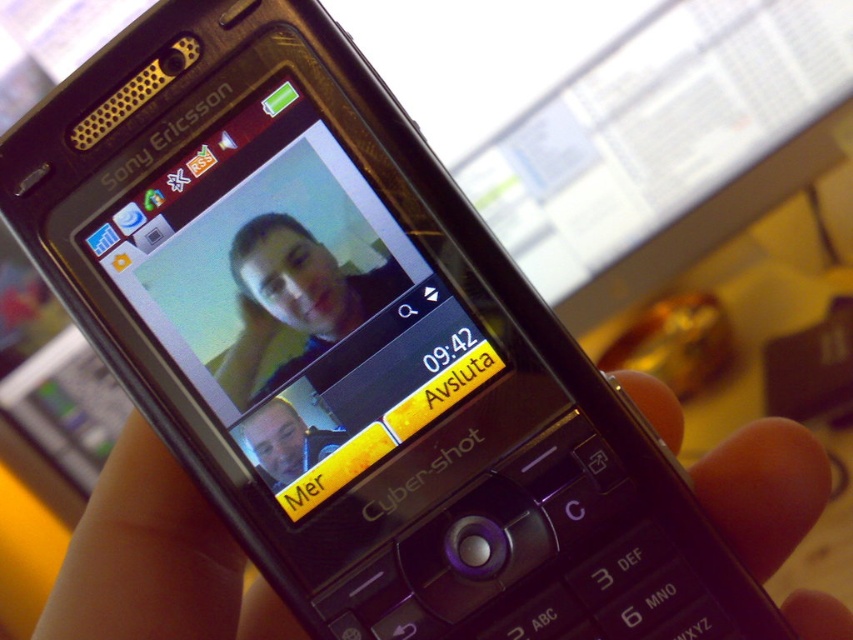
You are designing a phone case that needs to fit snugly around the black matte hand at center holding the phone. To ensure the case doesn not interfere with the hand grip, where should the case be designed to avoid? Please provide coordinates in the format x,y where x and y are between 0 and 1.

The case should avoid the area around the black matte hand at center located at coordinates (155, 561) to ensure it does not interfere with the grip.

You are a delivery robot with a 6.5 inch wide package. You need to navigate through a narrow space between the black matte hand at center and the matte black phone at center. Can you fit through the gap without dropping the package?

The gap between the black matte hand at center and the matte black phone at center is 6.60 inches. Since the package is 6.5 inches wide, it is slightly narrower than the gap, so the robot can fit through the space without dropping the package.

You are a user trying to end the video call on the matte black phone at center. The phone is held in front of your face. To reach the end button labeled Avsluta, you need to move your hand upwards or downwards relative to the matte black face at center. Which direction should you move your hand?

The matte black phone at center is above the matte black face at center. To reach the end button labeled Avsluta on the matte black phone at center, you should move your hand upwards relative to the matte black face at center.